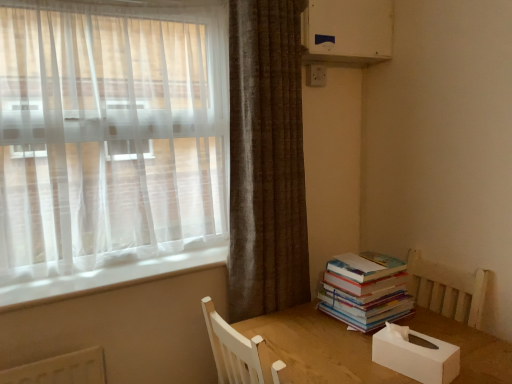
The width and height of the screenshot is (512, 384). Find the location of `free region under sheer white curtain at left, marked as the second curtain in a right-to-left arrangement (from a real-world perspective)`. free region under sheer white curtain at left, marked as the second curtain in a right-to-left arrangement (from a real-world perspective) is located at coordinates (112, 266).